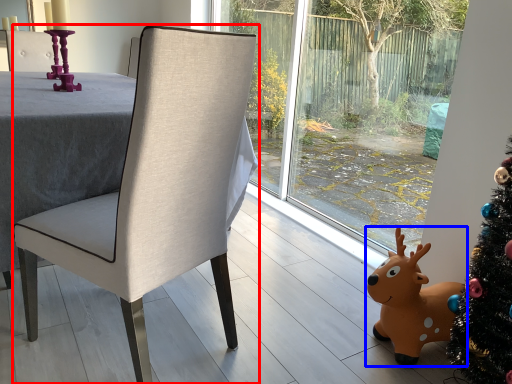
Question: Which of the following is the closest to the observer, chair (highlighted by a red box) or deer (highlighted by a blue box)?

Choices:
 (A) chair
 (B) deer

Answer: (A)